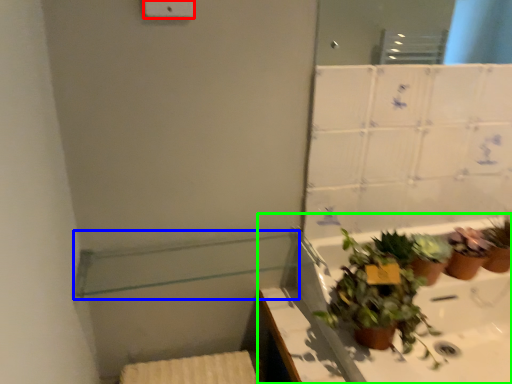
Question: Which object is positioned farthest from light switch (highlighted by a red box)? Select from balustrade (highlighted by a blue box) and bath (highlighted by a green box).

Choices:
 (A) balustrade
 (B) bath

Answer: (B)